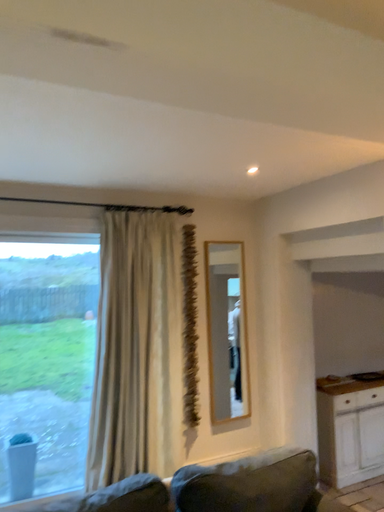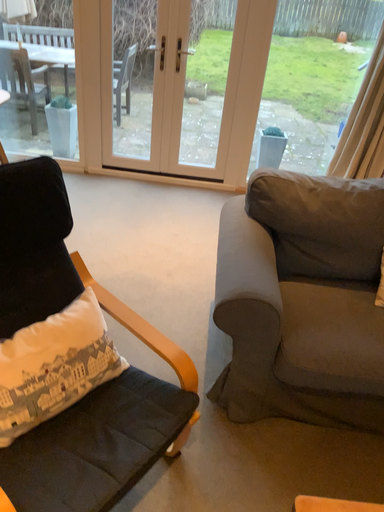
Question: How did the camera likely rotate when shooting the video?

Choices:
 (A) rotated downward
 (B) rotated upward

Answer: (A)